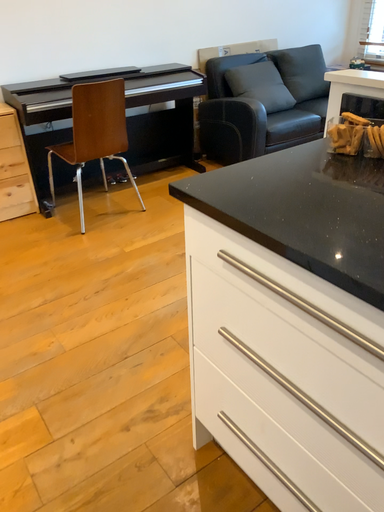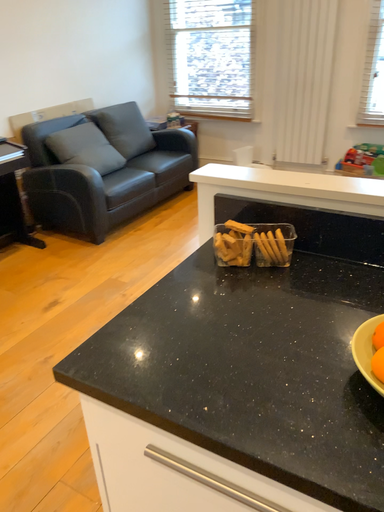
Question: Which way did the camera rotate in the video?

Choices:
 (A) rotated left
 (B) rotated right

Answer: (B)